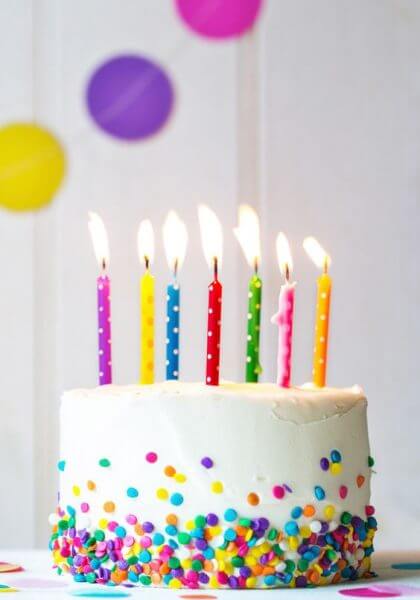
This screenshot has height=600, width=420. I want to click on candles, so click(324, 352), click(289, 349), click(249, 347), click(211, 344), click(169, 349), click(148, 348), click(109, 351).